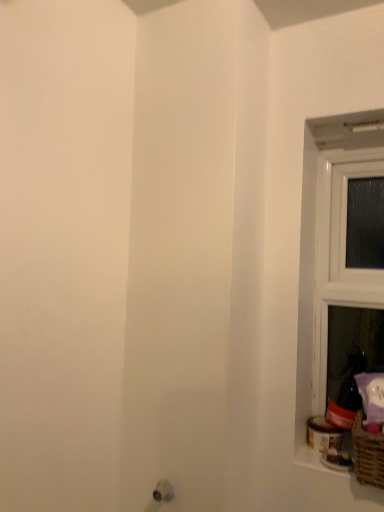
What do you see at coordinates (330, 250) in the screenshot? I see `white plastic window at right` at bounding box center [330, 250].

Measure the distance between point (312, 272) and camera.

The depth of point (312, 272) is 1.33 meters.

Identify the location of white plastic window at right. This screenshot has width=384, height=512. (330, 250).

Locate an element on the screen. white plastic window at right is located at coordinates click(330, 250).